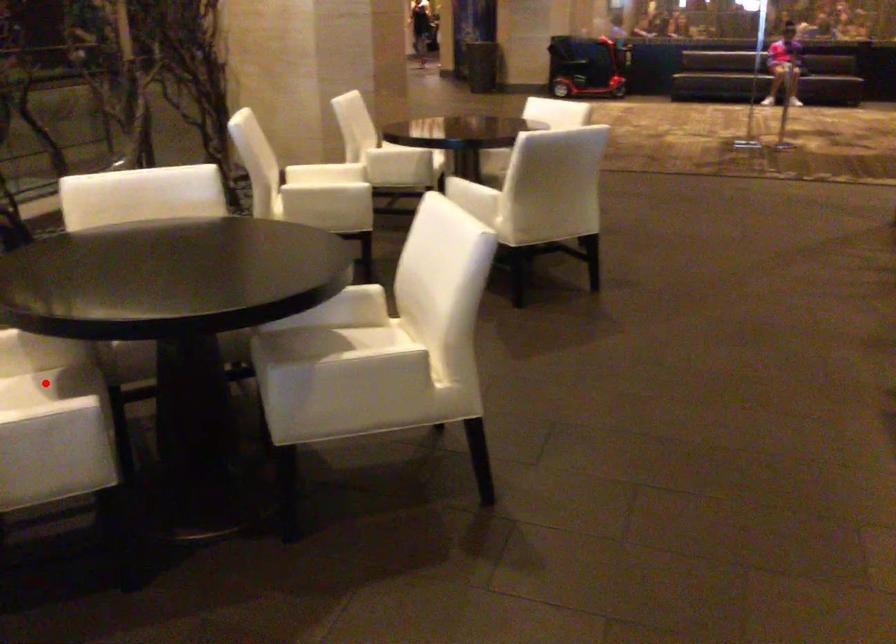
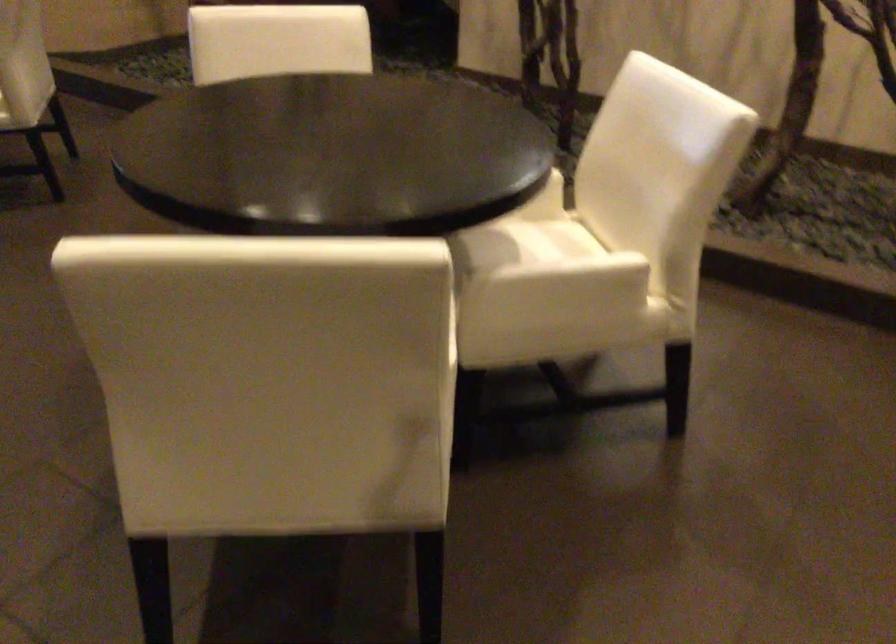
Question: I am providing you with two images of the same scene from different viewpoints. A red point is marked on the first image. Is the red point's position out of view in image 2?

Choices:
 (A) Yes
 (B) No

Answer: (A)